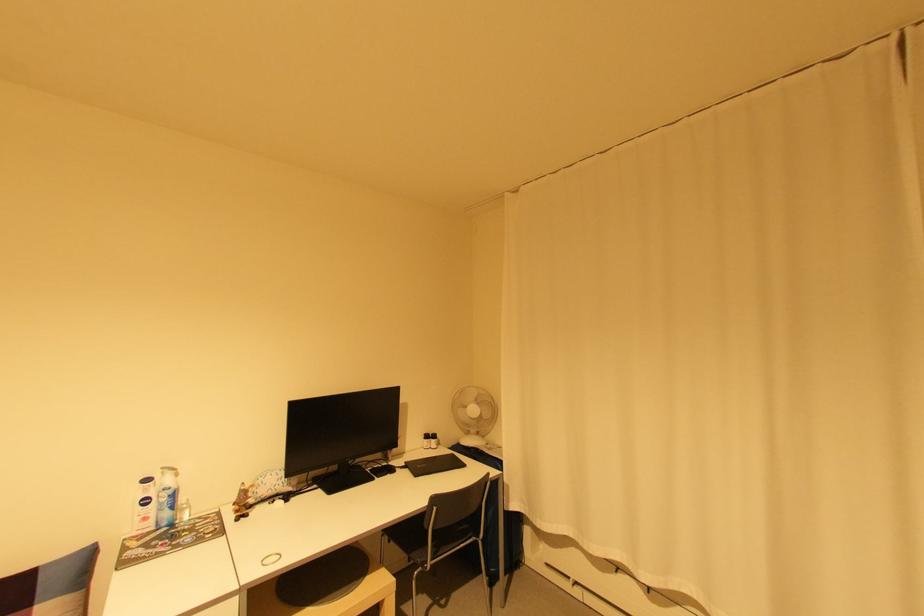
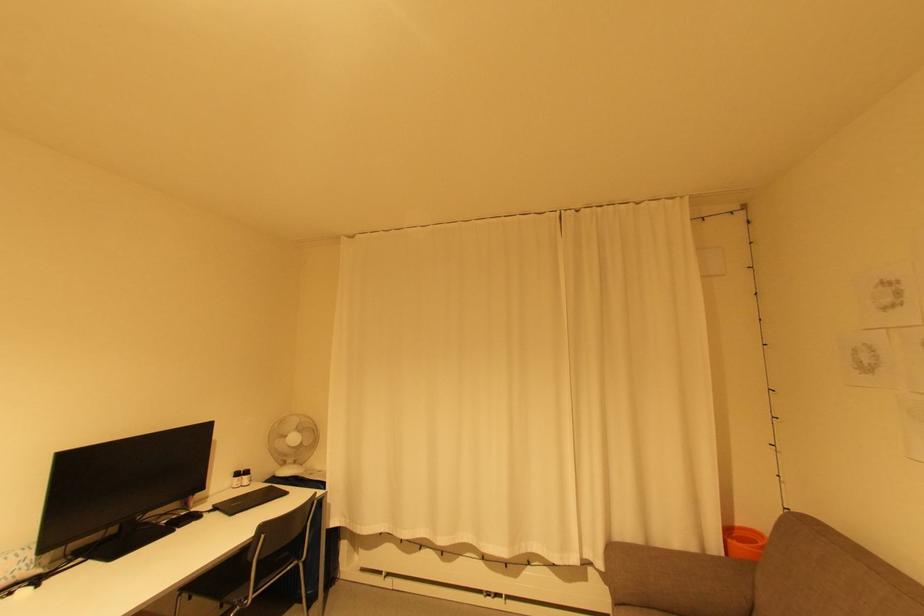
Question: The images are taken continuously from a first-person perspective. In which direction is your viewpoint rotating?

Choices:
 (A) Left
 (B) Right
 (C) Up
 (D) Down

Answer: (B)